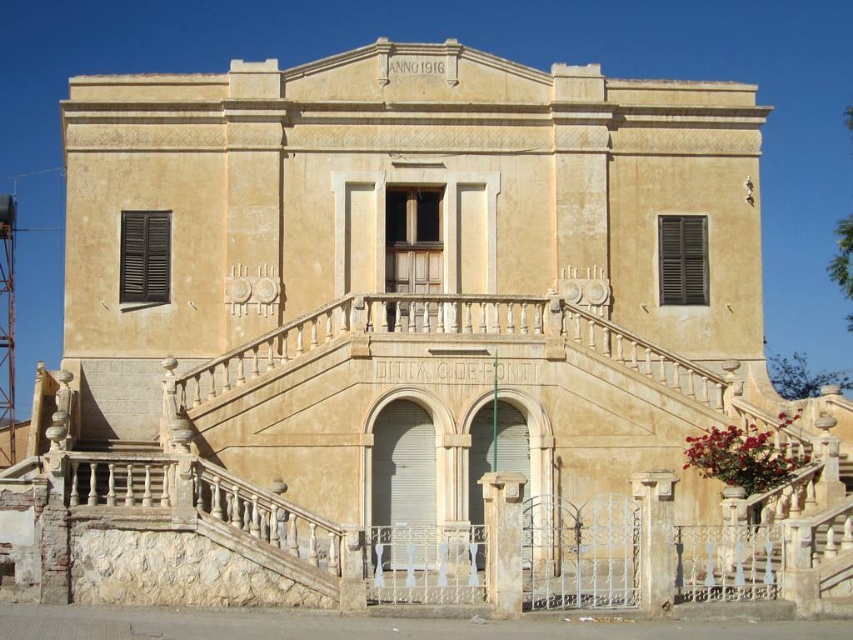
You are a delivery person standing at the entrance of the building. You need to deliver a package to the matte black shutters at left and dark wood shutters at center. The delivery vehicle can only approach within 80 feet of either shutters. Can you deliver both packages without moving the vehicle?

The matte black shutters at left is 79.28 feet from dark wood shutters at center. Since the distance between them is less than 80 feet, the delivery vehicle can stay within the 80 feet range of both shutters, so yes, you can deliver both packages without moving the vehicle.